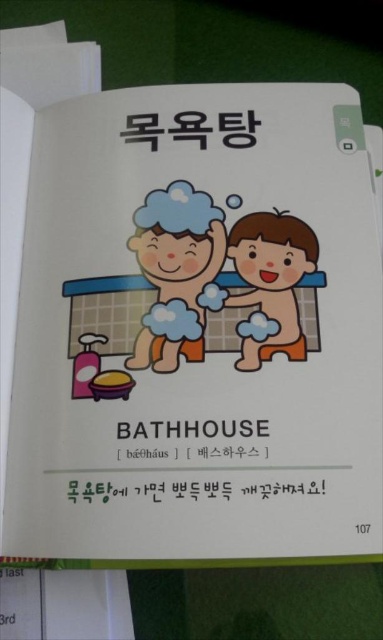
Between matte blue sponge at center and smooth orange sponge at center, which one is positioned lower?

smooth orange sponge at center is below.

Does matte blue sponge at center have a lesser height compared to smooth orange sponge at center?

In fact, matte blue sponge at center may be taller than smooth orange sponge at center.

Image resolution: width=383 pixels, height=640 pixels. Describe the element at coordinates (178, 273) in the screenshot. I see `matte blue sponge at center` at that location.

At what (x,y) coordinates should I click in order to perform the action: click on matte blue sponge at center. Please return your answer as a coordinate pair (x, y). Looking at the image, I should click on (178, 273).